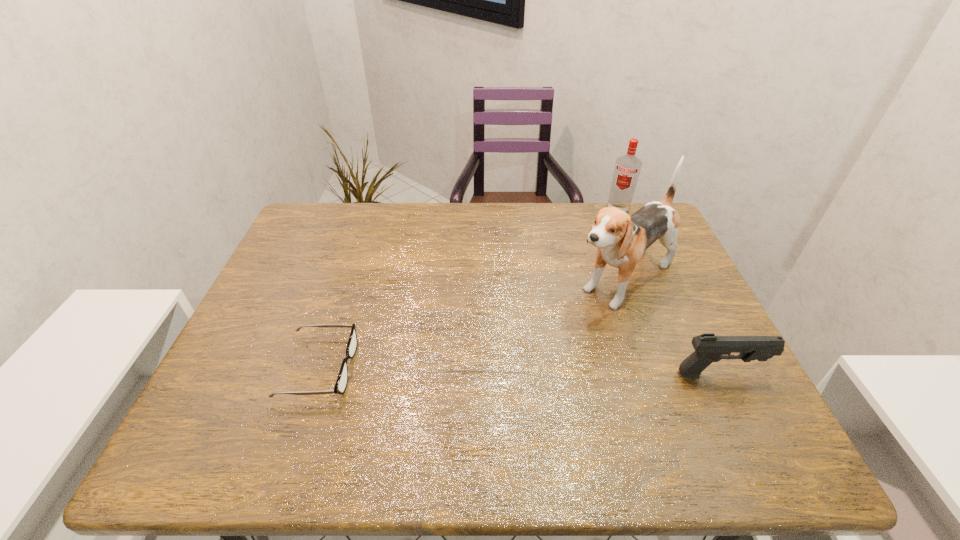
The width and height of the screenshot is (960, 540). In order to click on vacant area between the third tallest object and the third nearest object in this screenshot , I will do `click(671, 327)`.

This screenshot has width=960, height=540. What are the coordinates of `empty space that is in between the spectacles and the vodka` in the screenshot? It's located at (468, 289).

This screenshot has width=960, height=540. What are the coordinates of `vacant area that lies between the leftmost object and the tallest object` in the screenshot? It's located at (471, 323).

You are a GUI agent. You are given a task and a screenshot of the screen. Output one action in this format:
    pyautogui.click(x=<x>, y=<y>)
    Task: Click on the empty space between the pistol and the leftmost object
    
    Given the screenshot: What is the action you would take?
    pyautogui.click(x=519, y=371)

Locate an element on the screen. empty location between the second tallest object and the shortest object is located at coordinates (468, 289).

The image size is (960, 540). I want to click on free space between the spectacles and the third tallest object, so click(x=519, y=371).

Select which object is the closest to the vodka. Please provide its 2D coordinates. Your answer should be formatted as a tuple, i.e. [(x, y)], where the tuple contains the x and y coordinates of a point satisfying the conditions above.

[(621, 239)]

I want to click on object identified as the closest to the leftmost object, so click(621, 239).

This screenshot has width=960, height=540. In order to click on vacant point that satisfies the following two spatial constraints: 1. on the front side of the third tallest object; 2. at the barrel of the tallest object in this screenshot , I will do `click(657, 374)`.